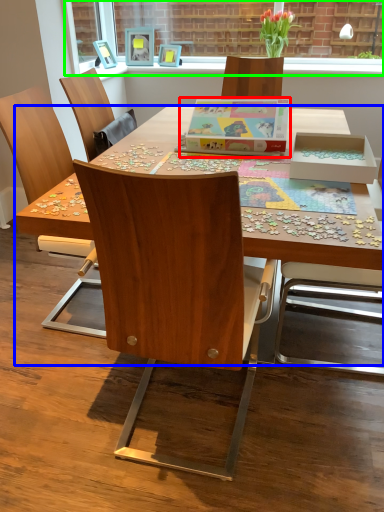
Question: Which object is the closest to the cardboard box (highlighted by a red box)? Choose among these: desk (highlighted by a blue box) or window screen (highlighted by a green box).

Choices:
 (A) desk
 (B) window screen

Answer: (A)